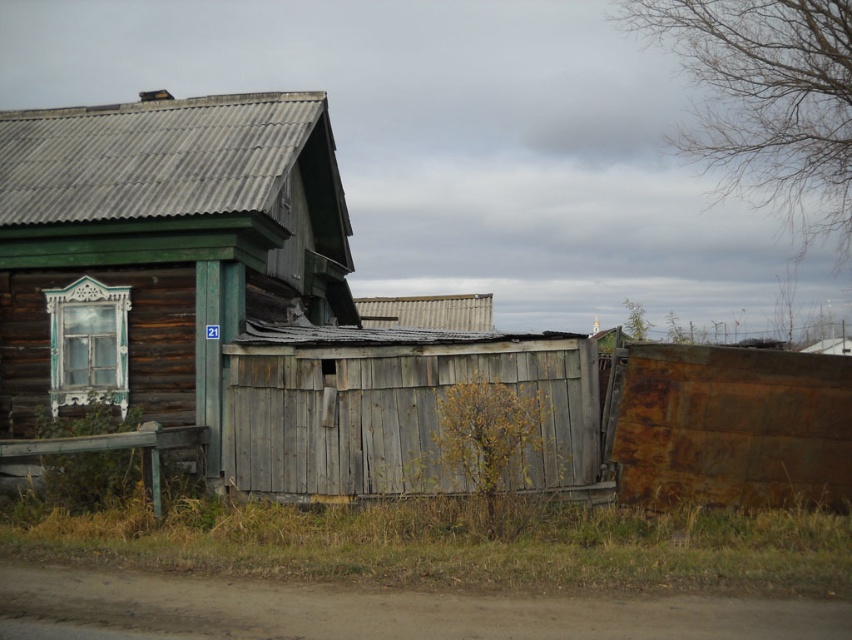
The image size is (852, 640). Describe the element at coordinates (160, 248) in the screenshot. I see `weathered wood hut at upper left` at that location.

Between point (291, 291) and point (738, 468), which one is positioned in front?

Point (738, 468) is in front.

Where is `weathered wood hut at upper left`? The height and width of the screenshot is (640, 852). weathered wood hut at upper left is located at coordinates (160, 248).